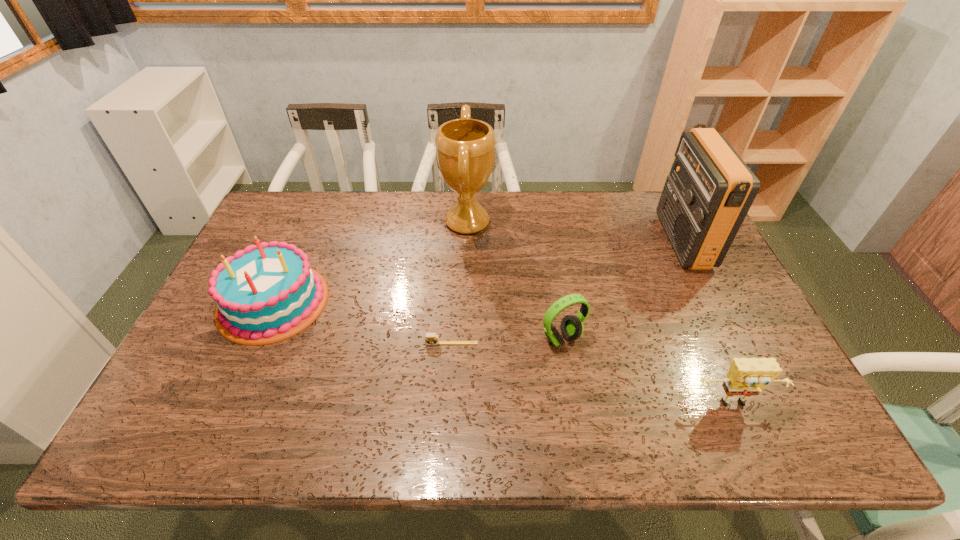
This screenshot has height=540, width=960. What are the coordinates of `free space between the nearest object and the radio receiver` in the screenshot? It's located at (708, 323).

Where is `free space between the shortest object and the fourth object from left to right`? free space between the shortest object and the fourth object from left to right is located at coordinates click(507, 341).

Locate an element on the screen. free space between the sponge and the radio receiver is located at coordinates (708, 323).

You are a GUI agent. You are given a task and a screenshot of the screen. Output one action in this format:
    pyautogui.click(x=<x>, y=<y>)
    Task: Click on the empty space that is in between the sponge and the radio receiver
    The image size is (960, 540).
    Given the screenshot: What is the action you would take?
    pyautogui.click(x=708, y=323)

Identify the location of empty location between the sponge and the radio receiver. Image resolution: width=960 pixels, height=540 pixels. (708, 323).

Where is `vacant area between the nearest object and the birthday cake`? This screenshot has width=960, height=540. vacant area between the nearest object and the birthday cake is located at coordinates (504, 354).

The image size is (960, 540). In order to click on free spot between the sponge and the radio receiver in this screenshot , I will do `click(708, 323)`.

The height and width of the screenshot is (540, 960). What are the coordinates of `the third closest object to the radio receiver` in the screenshot? It's located at (465, 148).

Choose which object is the second nearest neighbor to the radio receiver. Please provide its 2D coordinates. Your answer should be formatted as a tuple, i.e. [(x, y)], where the tuple contains the x and y coordinates of a point satisfying the conditions above.

[(747, 376)]

Identify the location of free space that satisfies the following two spatial constraints: 1. on the front-facing side of the radio receiver; 2. at the front of the shortest object with the tape extended. The height and width of the screenshot is (540, 960). (733, 343).